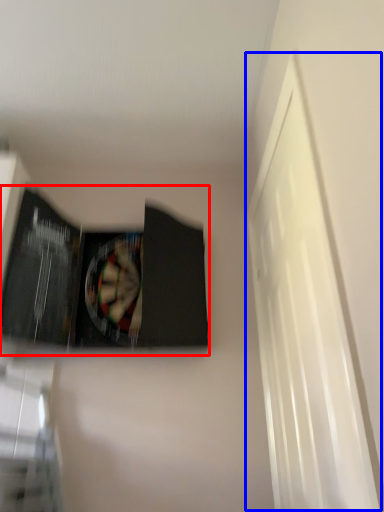
Question: Which point is closer to the camera, paperback book (highlighted by a red box) or window (highlighted by a blue box)?

Choices:
 (A) paperback book
 (B) window

Answer: (B)